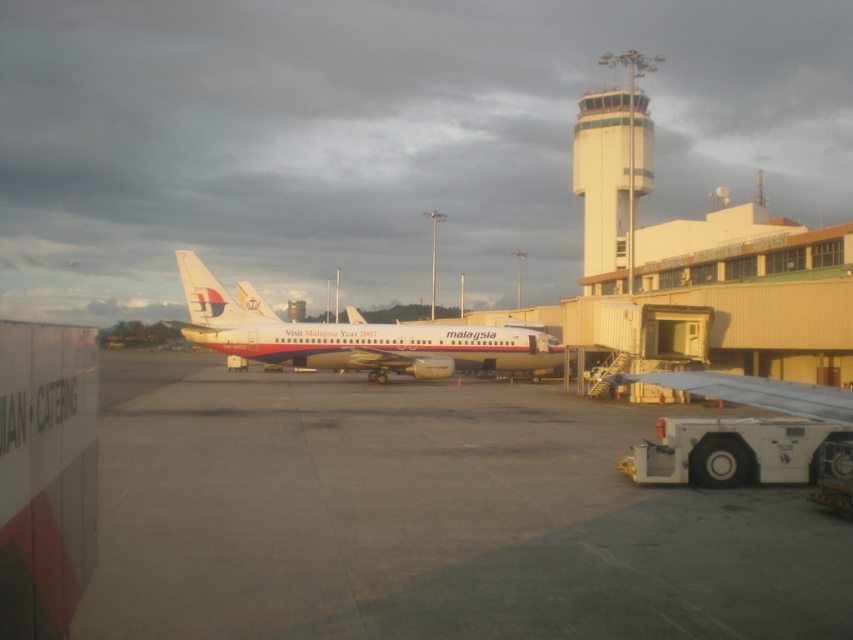
Question: Does gray concrete tarmac at center appear under white concrete control tower at upper center?

Choices:
 (A) no
 (B) yes

Answer: (B)

Question: In this image, where is gray concrete tarmac at center located relative to white concrete control tower at upper center?

Choices:
 (A) below
 (B) above

Answer: (A)

Question: Among these objects, which one is farthest from the camera?

Choices:
 (A) white concrete control tower at upper center
 (B) gray concrete tarmac at center

Answer: (A)

Question: Which is nearer to the white glossy airplane at center?

Choices:
 (A) white concrete control tower at upper center
 (B) gray concrete tarmac at center

Answer: (B)

Question: Which object is farther from the camera taking this photo?

Choices:
 (A) white concrete control tower at upper center
 (B) gray concrete tarmac at center
 (C) white glossy airplane at center

Answer: (A)

Question: Is white glossy airplane at center below white concrete control tower at upper center?

Choices:
 (A) yes
 (B) no

Answer: (A)